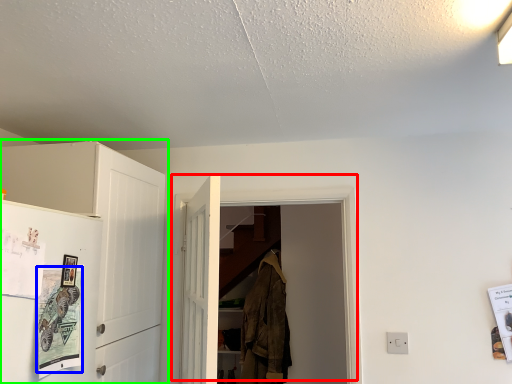
Question: Which object is positioned farthest from door (highlighted by a red box)? Select from poster (highlighted by a blue box) and cabinetry (highlighted by a green box).

Choices:
 (A) poster
 (B) cabinetry

Answer: (A)